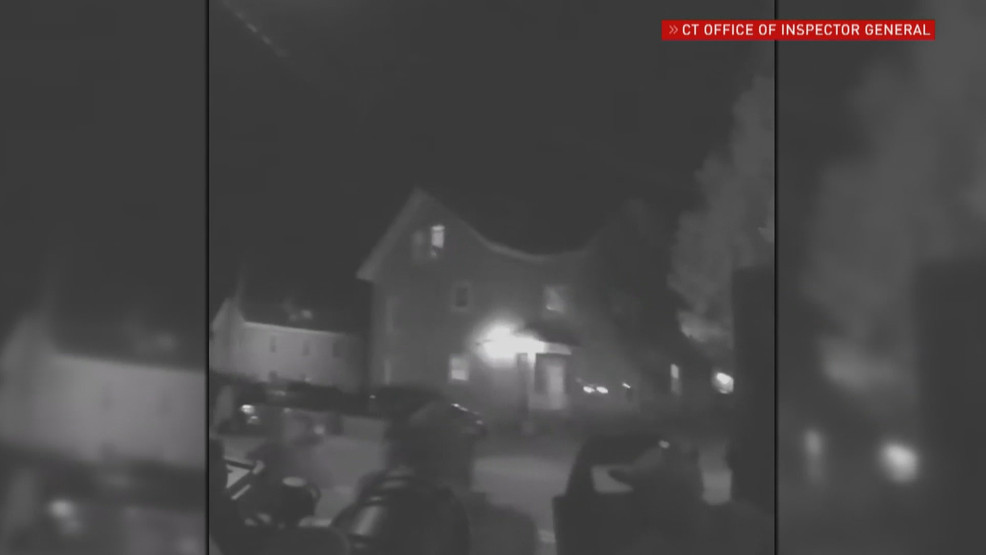
The image size is (986, 555). What are the coordinates of `window` in the screenshot? It's located at tap(430, 238).